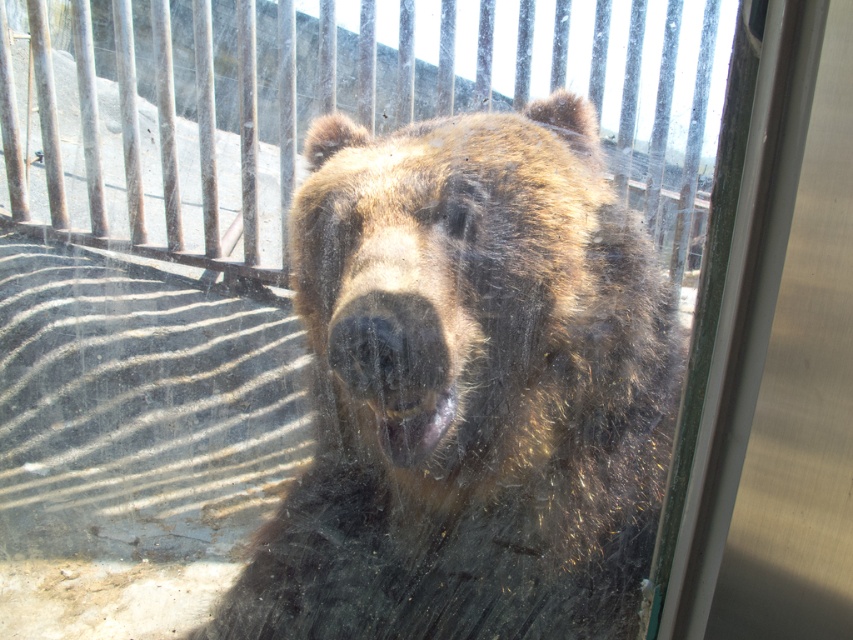
Question: Which point is farther to the camera?

Choices:
 (A) wooden at center
 (B) fuzzy brown bear at center

Answer: (A)

Question: Can you confirm if fuzzy brown bear at center is positioned below wooden at center?

Choices:
 (A) no
 (B) yes

Answer: (B)

Question: Which point appears closest to the camera in this image?

Choices:
 (A) (627, 132)
 (B) (532, 305)

Answer: (B)

Question: Does fuzzy brown bear at center have a larger size compared to wooden at center?

Choices:
 (A) yes
 (B) no

Answer: (B)

Question: Which object is farther from the camera taking this photo?

Choices:
 (A) wooden at center
 (B) fuzzy brown bear at center

Answer: (A)

Question: Can you confirm if fuzzy brown bear at center is bigger than wooden at center?

Choices:
 (A) no
 (B) yes

Answer: (A)